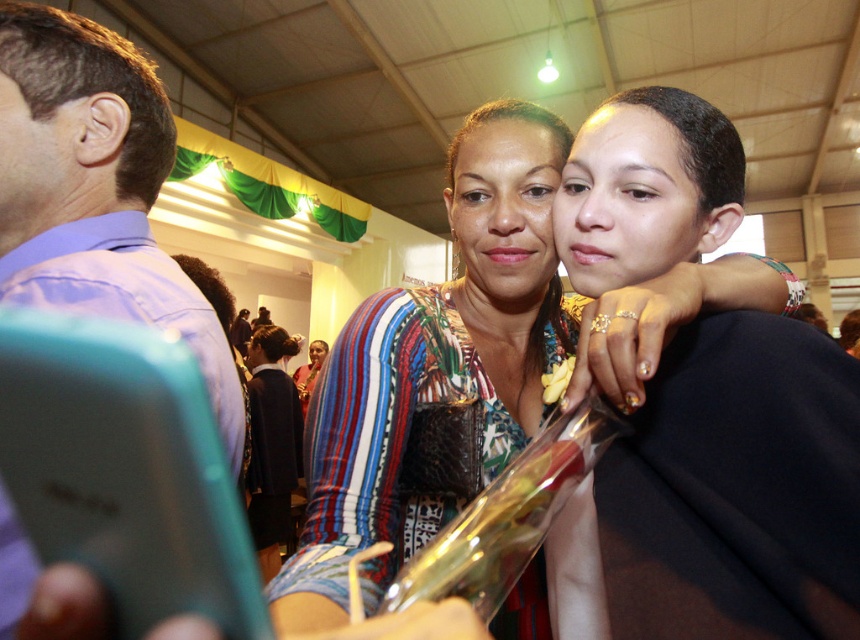
You are organizing a photo shoot and need to ensure that the multicolored fabric scarf at upper right and the purple cotton shirt at left are both visible in the frame. Given their sizes, which item might require more strategic placement to avoid being overshadowed?

The multicolored fabric scarf at upper right requires more strategic placement since its width is less than the purple cotton shirt at left, making it smaller and potentially easier to overlook in the composition.

You are planning to hang a decorative banner that requires 2 meters of space. You notice the multicolored fabric scarf at upper right and the purple cotton shirt at left in the image. Which object provides enough vertical space for the banner?

The purple cotton shirt at left is taller than the multicolored fabric scarf at upper right, so the purple cotton shirt at left provides enough vertical space for the banner.